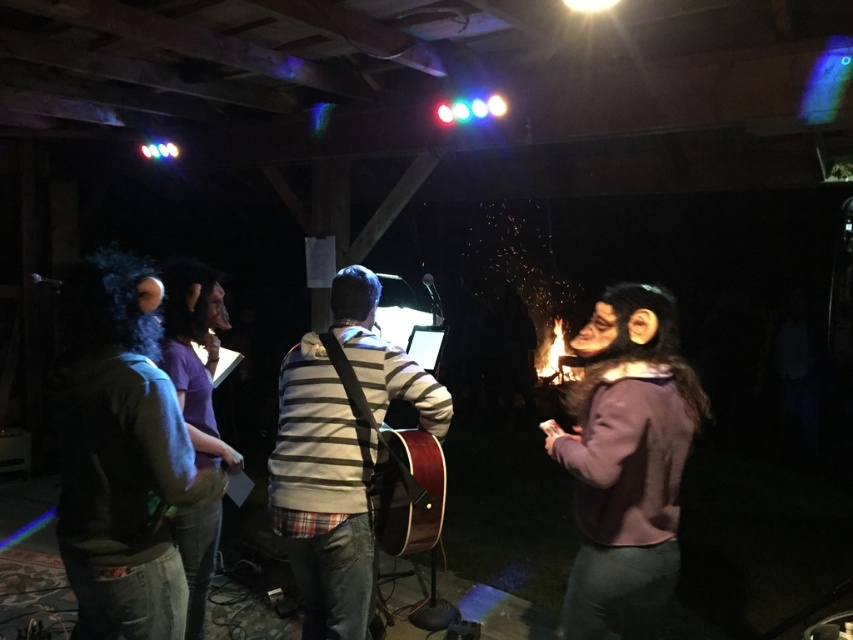
Between purple fleece sweater at right and wooden acoustic guitar at center, which one appears on the left side from the viewer's perspective?

wooden acoustic guitar at center is more to the left.

In order to click on purple fleece sweater at right in this screenshot , I will do `click(625, 461)`.

Locate an element on the screen. This screenshot has width=853, height=640. purple fleece sweater at right is located at coordinates (625, 461).

Does striped sweater at center have a larger size compared to wooden acoustic guitar at center?

Yes, striped sweater at center is bigger than wooden acoustic guitar at center.

Is point (317, 532) more distant than point (401, 529)?

No, it is not.

In order to click on striped sweater at center in this screenshot , I will do `click(323, 493)`.

Find the location of a particular element. The width and height of the screenshot is (853, 640). striped sweater at center is located at coordinates (323, 493).

At what (x,y) coordinates should I click in order to perform the action: click on purple fleece sweater at right. Please return your answer as a coordinate pair (x, y). This screenshot has width=853, height=640. Looking at the image, I should click on (625, 461).

Identify the location of purple fleece sweater at right. This screenshot has width=853, height=640. (625, 461).